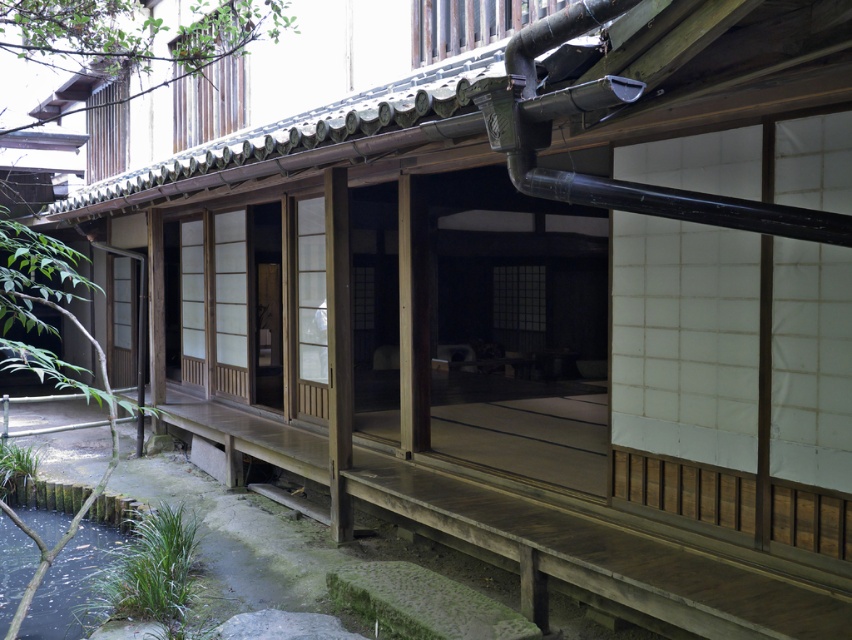
You are a visitor to this Japanese house and want to cross from the wooden platform to the garden. The wooden shoji screen at center is in your way. Can you walk around it without stepping into the green mossy pond at lower left?

The green mossy pond at lower left is wider than the wooden shoji screen at center, so you can walk around the wooden shoji screen at center on either side without stepping into the green mossy pond at lower left.

You are standing at the entrance of the traditional Japanese house and want to find the green mossy pond at lower left. According to the coordinates provided, where should you look relative to your current position?

The green mossy pond at lower left is located at coordinates point (70, 582), which means it is positioned to the lower left relative to your current position at the entrance of the traditional Japanese house.

You are standing on the wooden platform in front of the house and want to see the green mossy pond at lower left. Which direction should you look relative to the wooden shoji screen at center?

The green mossy pond at lower left is below the wooden shoji screen at center, so you should look downward towards the wooden shoji screen at center to see it.